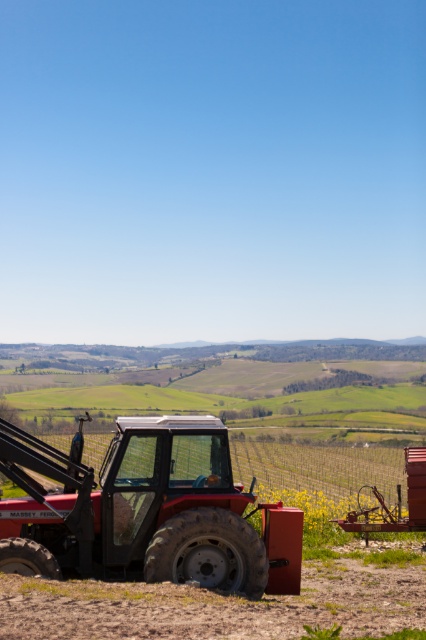
You are standing at the base of the hills in the middle ground and want to move towards the tractor and the dirt. Which object, the matte red tractor at lower left or the dull brown dirt at lower right, is closer to your current position?

The matte red tractor at lower left is closer to your current position because it is above the dull brown dirt at lower right, indicating it is nearer in the scene.

You are standing at the origin point of the image coordinate system. The image coordinate system has its origin at the bottom left corner. You want to move towards the matte red tractor at lower left. Which direction should you move? Please answer with direction in terms of coordinate system.

Since the origin is at the bottom left corner, the matte red tractor at lower left is located at point 0.798 in the x direction and 0.343 in the y direction. Therefore, you should move in the positive x and positive y direction to reach it.

You are a farmer assessing the space in your field. You need to move the matte red tractor at lower left to make room for a new piece of equipment. Considering the size of the dull brown dirt at lower right, will the tractor fit entirely on that spot?

The matte red tractor at lower left is larger in size than the dull brown dirt at lower right, so it won won t fit entirely on that spot.